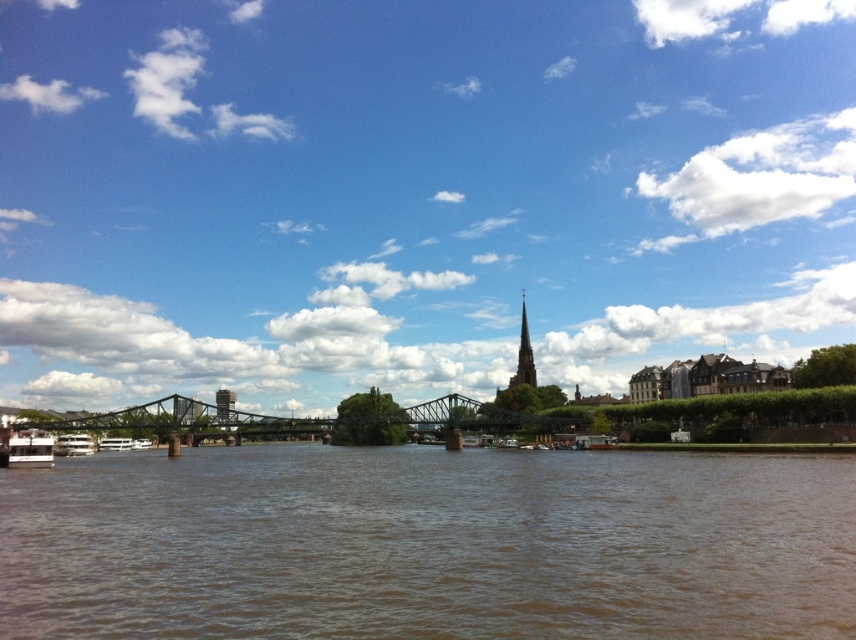
You are an architect designing a new observation deck that needs to be 10 meters tall. You look at the image and see the blue sky at upper center and the metallic gray tower at left. Which object in the image can help you determine if your observation deck will be taller than the existing structures?

The blue sky at upper center is much taller than the metallic gray tower at left, so the observation deck at 10 meters will be shorter than the blue sky at upper center but taller than the metallic gray tower at left if the tower is shorter than 10 meters. However, without knowing the exact height of the tower, it is difficult to determine precisely.

Consider the image. You are standing at point (536, 420) and want to cross the river to the opposite bank. The bridge on the left has a maximum weight capacity of 500 pounds. If your boat weighs 450 pounds, can you safely cross using the bridge?

The distance between you at point (536, 420) and the bridge on the left is 515.99 feet. Since your boat weighs 450 pounds, which is under the bridge maximum weight capacity of 500 pounds, you can safely cross using the bridge on the left.

You are planning to take a photo of the metallic bridge at center and the green stone spire at upper right. Since you want both objects to be clearly visible in the frame, which object should you focus on first to ensure proper focus, considering their sizes and positions?

The metallic bridge at center has a larger size compared to the green stone spire at upper right, so you should focus on the metallic bridge at center first to ensure proper focus as it is the larger object in the scene.